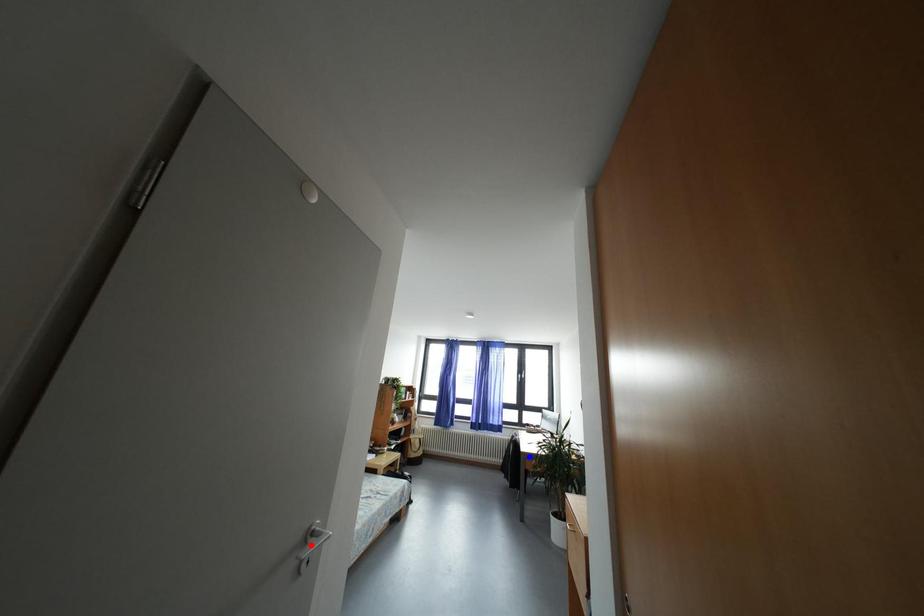
Question: Two points are marked on the image. Which point is closer to the camera?

Choices:
 (A) Blue point is closer.
 (B) Red point is closer.

Answer: (B)